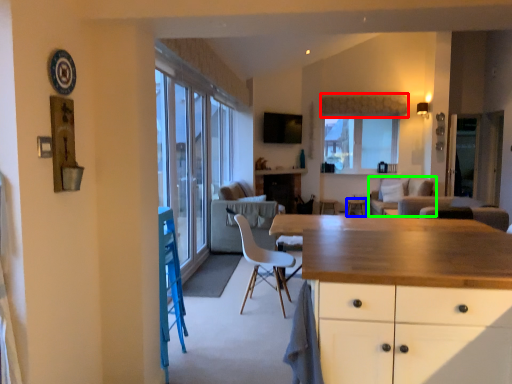
Question: Which object is positioned farthest from curtain (highlighted by a red box)? Select from table (highlighted by a blue box) and couch (highlighted by a green box).

Choices:
 (A) table
 (B) couch

Answer: (A)